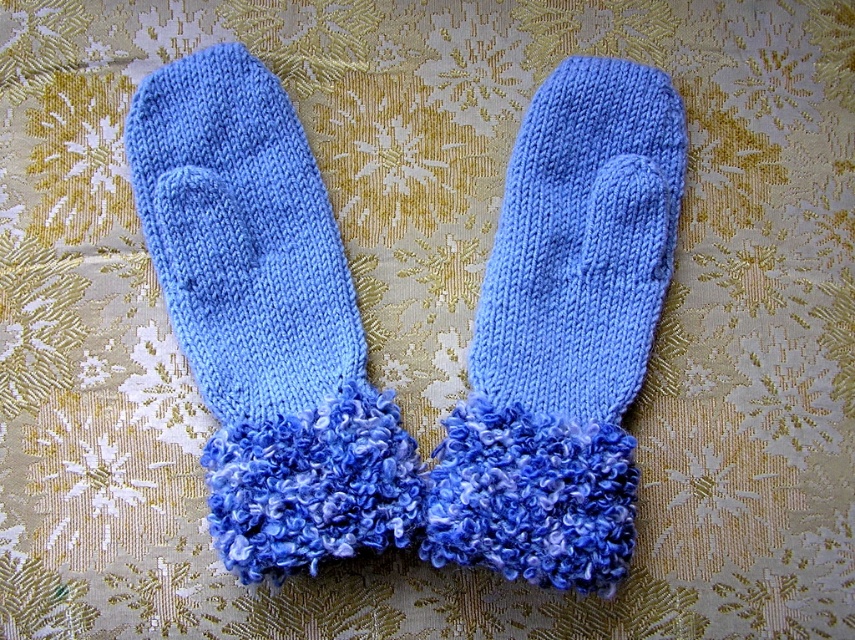
Is blue knitted sock at left positioned in front of blue knitted mittens at center?

No, blue knitted sock at left is further to the viewer.

Which is behind, point (332, 348) or point (675, 184)?

The point (332, 348) is behind.

Identify the location of blue knitted sock at left. (266, 321).